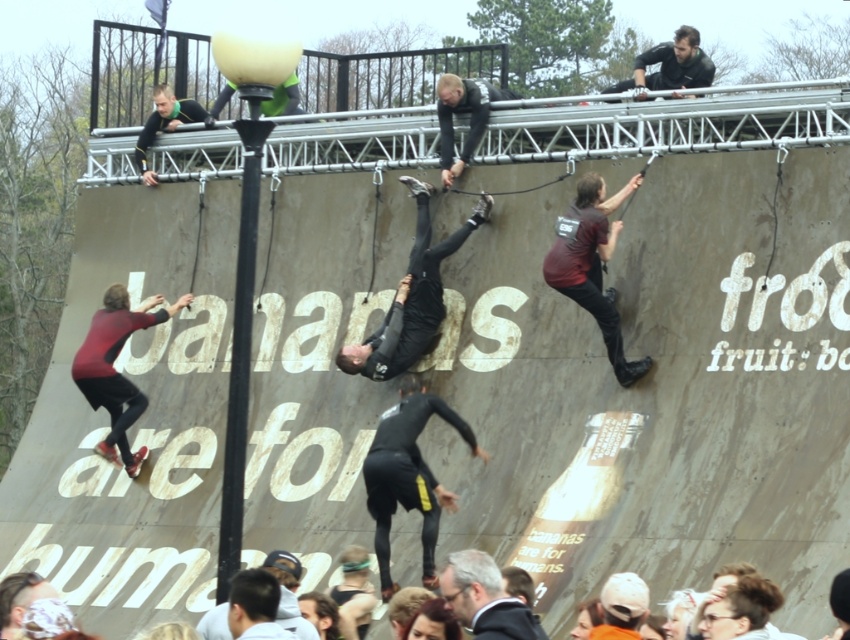
You are an observer standing at the base of the obstacle course wall. You notice two points marked on the wall at coordinates point (656, 45) and point (247, 634). Which point is closer to your current position?

Point (247, 634) is closer to your current position because it is less further to the viewer than point (656, 45), which is further away.

You are a drone operator trying to capture a closeup shot of the black wetsuit at center. The drone has a maximum range of 250 feet. Can the drone safely capture the shot without exceeding its range?

The black wetsuit at center is 242.79 feet away from the viewer. Since the drone has a maximum range of 250 feet, it can safely capture the shot as the distance is within the drone operator range limit.

You are a participant in the obstacle course and need to reach the dark gray fabric at upper center. Based on its position, which part of the wall should you aim to climb towards?

The dark gray fabric at upper center is located at point (670, 65), so you should aim to climb towards the upper center section of the wall to reach it.